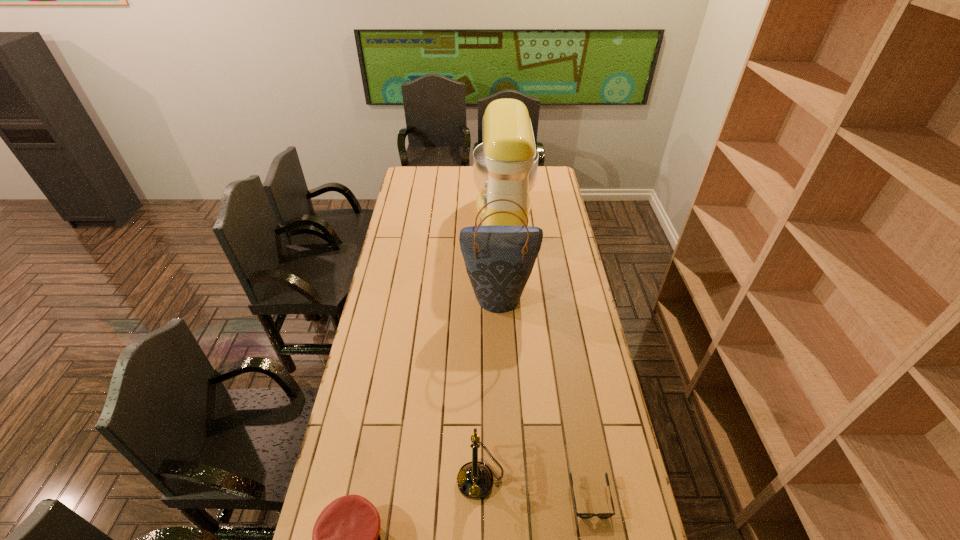
You are a GUI agent. You are given a task and a screenshot of the screen. Output one action in this format:
    pyautogui.click(x=<x>, y=<y>)
    Task: Click on the farthest object
    The width and height of the screenshot is (960, 540).
    Given the screenshot: What is the action you would take?
    pyautogui.click(x=505, y=165)

Image resolution: width=960 pixels, height=540 pixels. What are the coordinates of `the tallest object` in the screenshot? It's located at (505, 165).

Find the location of a particular element. shopping bag is located at coordinates (499, 259).

Find the location of a particular element. the second farthest object is located at coordinates (499, 259).

The height and width of the screenshot is (540, 960). What are the coordinates of `the third tallest object` in the screenshot? It's located at 475,479.

Identify the location of the shortest object. [581, 515].

Identify the location of blank area located 0.300m on the side of the farthest object with the control knob. (416, 218).

Identify the location of vacant space located 0.130m on the side of the farthest object with the control knob. click(448, 218).

At what (x,y) coordinates should I click in order to perform the action: click on vacant space situated 0.180m on the side of the farthest object with the control knob. Please return your answer as a coordinate pair (x, y). Looking at the image, I should click on (439, 218).

This screenshot has width=960, height=540. I want to click on vacant space positioned 0.340m on the left of the second tallest object, so click(382, 295).